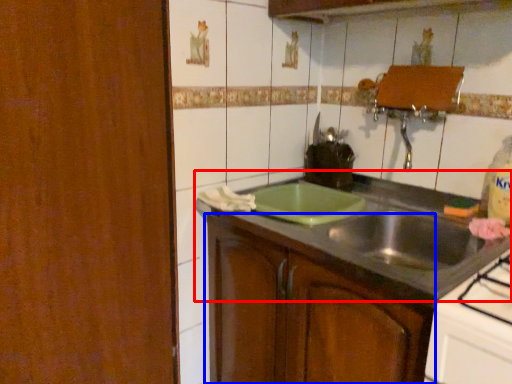
Question: Which point is further to the camera, countertop (highlighted by a red box) or cabinetry (highlighted by a blue box)?

Choices:
 (A) countertop
 (B) cabinetry

Answer: (B)